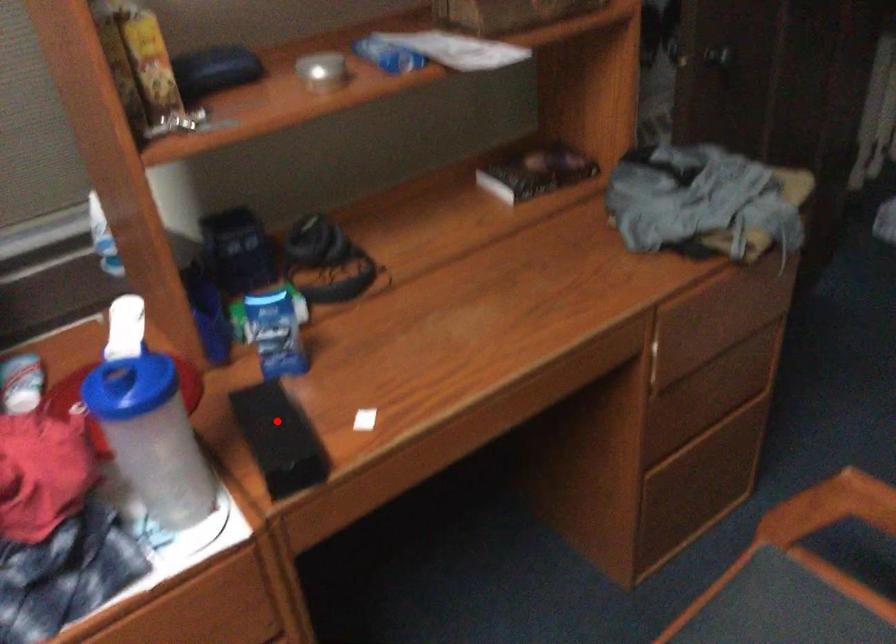
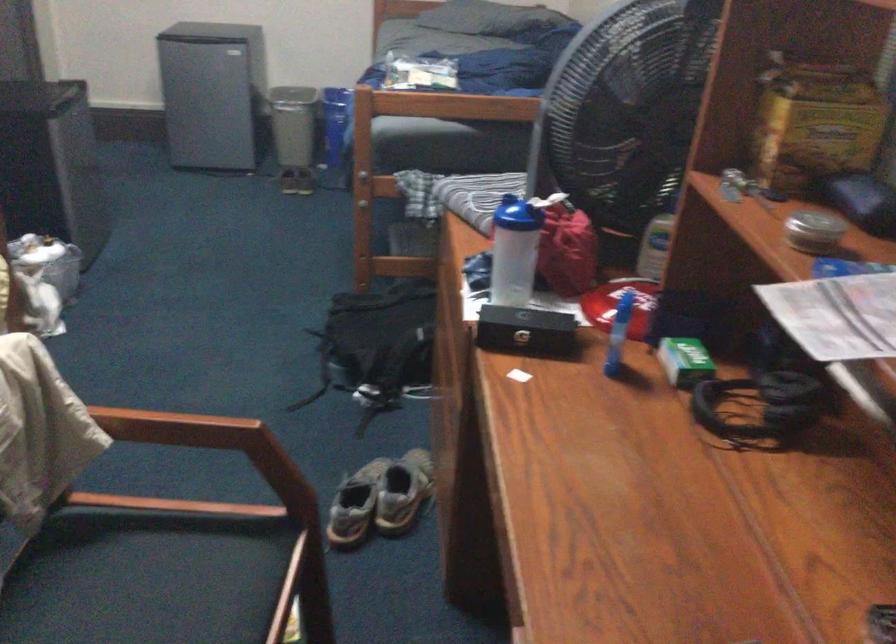
Question: I am providing you with two images of the same scene from different viewpoints. In image1, a red point is highlighted. Considering the same 3D point in image2, which of the following is correct?

Choices:
 (A) It is closer
 (B) It is farther

Answer: (B)